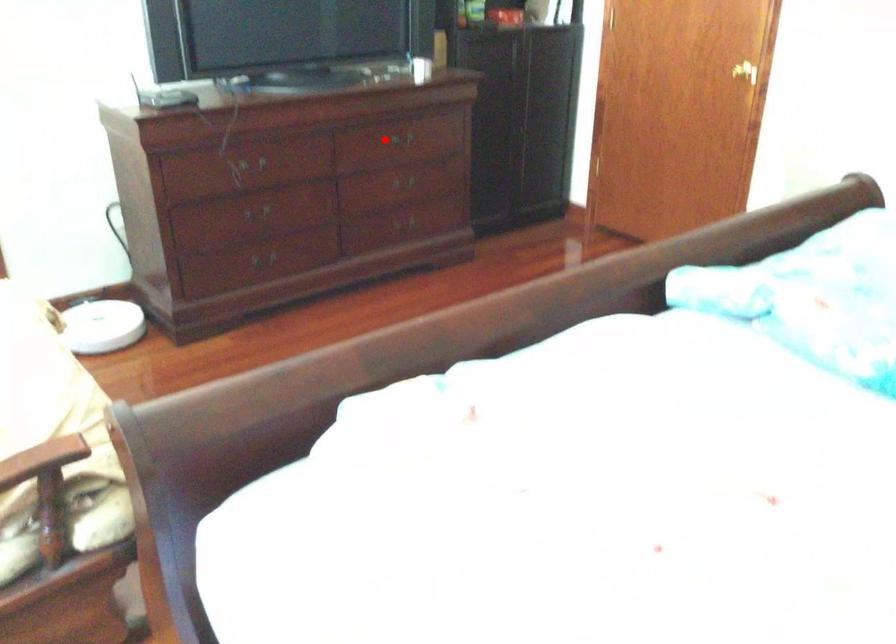
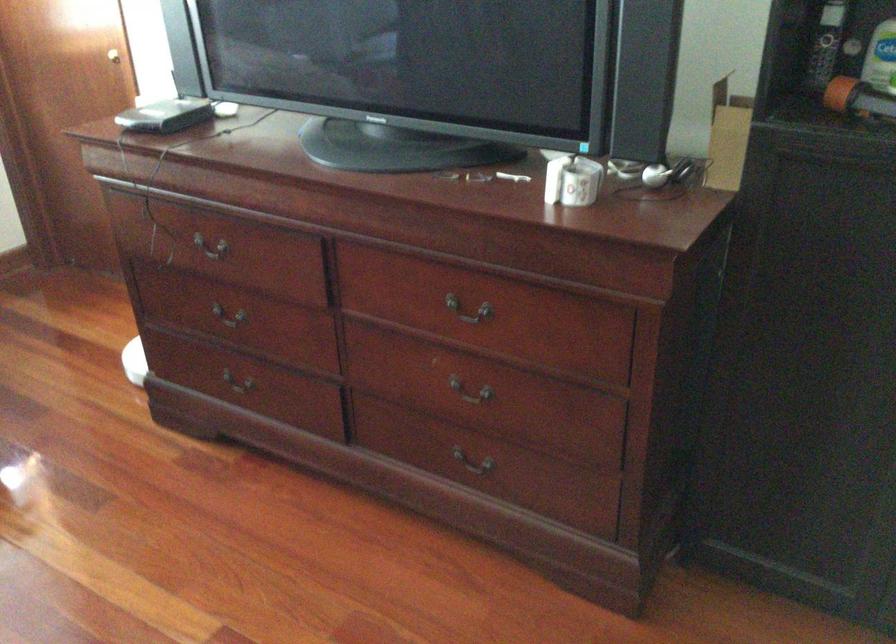
In the second image, find the point that corresponds to the highlighted location in the first image.

(469, 310)